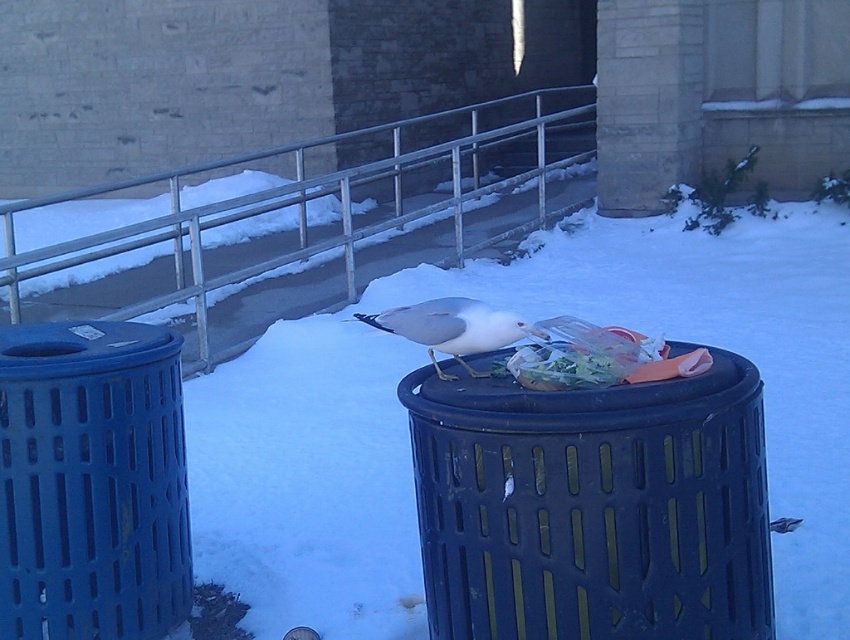
Between matte black trash can at center and translucent plastic bag at center, which one has more height?

Standing taller between the two is matte black trash can at center.

Is matte black trash can at center bigger than translucent plastic bag at center?

Yes, matte black trash can at center is bigger than translucent plastic bag at center.

Is point (591, 573) more distant than point (522, 385)?

No, it is not.

I want to click on matte black trash can at center, so click(x=593, y=506).

Which is in front, point (527, 422) or point (54, 445)?

Point (527, 422) is in front.

Between matte black trash can at center and blue plastic trash can at left, which one is positioned higher?

matte black trash can at center

Between point (507, 525) and point (38, 516), which one is positioned behind?

Positioned behind is point (38, 516).

Where is `matte black trash can at center`? matte black trash can at center is located at coordinates (593, 506).

Can you confirm if blue plastic trash can at left is smaller than brushed metal rail at center?

No.

Can you confirm if blue plastic trash can at left is taller than brushed metal rail at center?

Indeed, blue plastic trash can at left has a greater height compared to brushed metal rail at center.

What are the coordinates of `blue plastic trash can at left` in the screenshot? It's located at (91, 481).

This screenshot has height=640, width=850. In order to click on blue plastic trash can at left in this screenshot , I will do `click(91, 481)`.